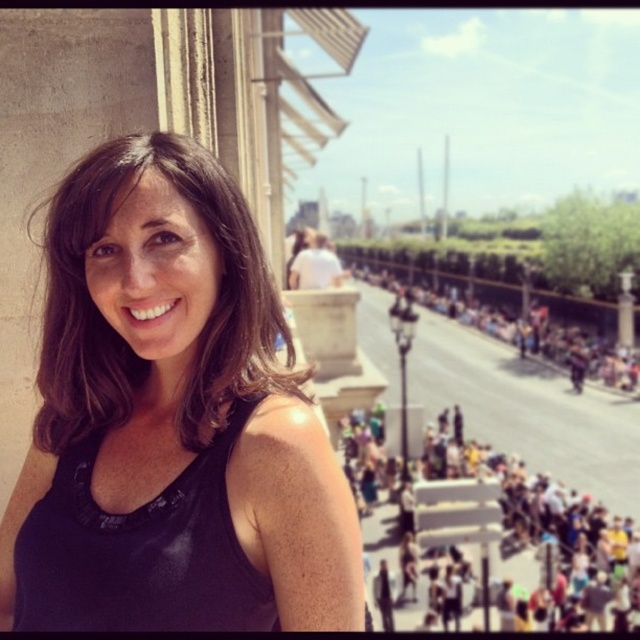
Question: Is black matte vest at upper left thinner than dark gray concrete crowd at center?

Choices:
 (A) no
 (B) yes

Answer: (B)

Question: Does black matte vest at upper left appear under dark gray concrete crowd at center?

Choices:
 (A) yes
 (B) no

Answer: (A)

Question: Considering the real-world distances, which object is closest to the multicolored fabric crowd at lower right?

Choices:
 (A) dark brown hair at center
 (B) black matte vest at upper left
 (C) dark gray concrete crowd at center

Answer: (C)

Question: Based on their relative distances, which object is nearer to the black matte vest at upper left?

Choices:
 (A) dark gray concrete crowd at center
 (B) multicolored fabric crowd at lower right

Answer: (B)

Question: Does dark brown hair at center have a smaller size compared to dark gray concrete crowd at center?

Choices:
 (A) yes
 (B) no

Answer: (A)

Question: Which object is closer to the camera taking this photo?

Choices:
 (A) dark gray concrete crowd at center
 (B) multicolored fabric crowd at lower right
 (C) dark brown hair at center

Answer: (C)